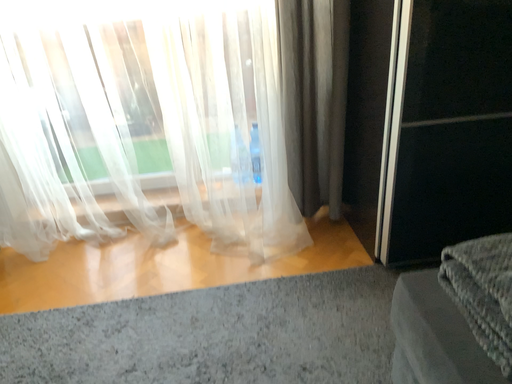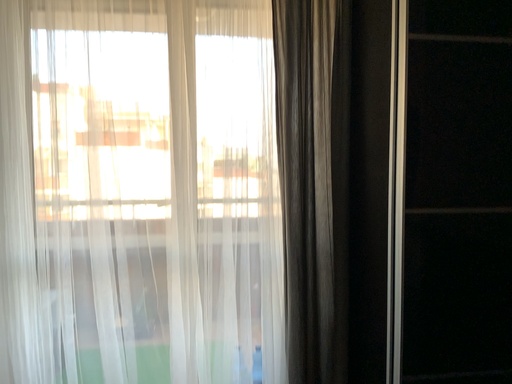
Question: Which way did the camera rotate in the video?

Choices:
 (A) rotated upward
 (B) rotated downward

Answer: (A)